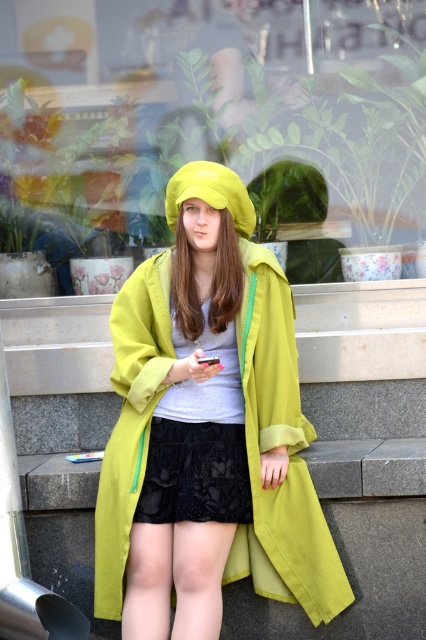
Which is behind, point (412, 93) or point (112, 547)?

The point (412, 93) is more distant.

Does transparent glass shop window at center appear on the left side of matte green coat at center?

Indeed, transparent glass shop window at center is positioned on the left side of matte green coat at center.

Between point (8, 22) and point (224, 321), which one is positioned behind?

Point (8, 22)

Locate an element on the screen. The width and height of the screenshot is (426, 640). transparent glass shop window at center is located at coordinates (218, 120).

In the scene shown: Does matte green coat at center have a smaller size compared to black lace shorts at center?

Actually, matte green coat at center might be larger than black lace shorts at center.

Is matte green coat at center to the left of black lace shorts at center from the viewer's perspective?

Incorrect, matte green coat at center is not on the left side of black lace shorts at center.

Locate an element on the screen. matte green coat at center is located at coordinates pyautogui.click(x=207, y=429).

Is the position of transparent glass shop window at center less distant than that of black lace shorts at center?

No, transparent glass shop window at center is further to the viewer.

This screenshot has width=426, height=640. I want to click on transparent glass shop window at center, so click(218, 120).

Which is behind, point (385, 64) or point (186, 449)?

The point (385, 64) is behind.

Identify the location of transparent glass shop window at center. (218, 120).